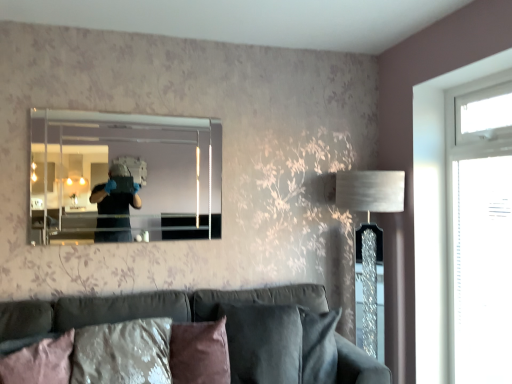
In order to face transparent glass window at right, should I rotate leftwards or rightwards?

To face it directly, rotate right by 28.331 degrees.

Locate an element on the screen. velvet dark gray couch at lower center is located at coordinates (141, 308).

Where is `transparent glass door at right`? transparent glass door at right is located at coordinates (482, 269).

Measure the distance between point (494, 338) and camera.

Point (494, 338) is 2.25 meters away from camera.

Locate an element on the screen. The height and width of the screenshot is (384, 512). clear glass mirror at upper center is located at coordinates (124, 176).

What do you see at coordinates (370, 230) in the screenshot? The image size is (512, 384). I see `silver textured lampshade at right` at bounding box center [370, 230].

Describe the element at coordinates (199, 353) in the screenshot. Image resolution: width=512 pixels, height=384 pixels. I see `brown suede pillow at lower center, the first pillow viewed from the right` at that location.

Find the location of a particular element. transparent glass window at right is located at coordinates (436, 207).

Considering the positions of objects transparent glass door at right and clear glass mirror at upper center in the image provided, who is more to the right, transparent glass door at right or clear glass mirror at upper center?

Positioned to the right is transparent glass door at right.

You are a GUI agent. You are given a task and a screenshot of the screen. Output one action in this format:
    pyautogui.click(x=<x>, y=<y>)
    Task: Click on the mirror above the transparent glass door at right (from the image's perspective)
    The height and width of the screenshot is (384, 512).
    Given the screenshot: What is the action you would take?
    pyautogui.click(x=124, y=176)

Who is shorter, transparent glass door at right or clear glass mirror at upper center?

clear glass mirror at upper center.

Considering the sizes of objects transparent glass door at right and clear glass mirror at upper center in the image provided, who is smaller, transparent glass door at right or clear glass mirror at upper center?

transparent glass door at right.

Are clear glass mirror at upper center and silver textured lampshade at right making contact?

clear glass mirror at upper center is not next to silver textured lampshade at right, and they're not touching.

Is clear glass mirror at upper center closer to camera compared to silver textured lampshade at right?

Yes, it is in front of silver textured lampshade at right.

Based on the photo, from a real-world perspective, is clear glass mirror at upper center positioned above or below silver textured lampshade at right?

clear glass mirror at upper center is situated higher than silver textured lampshade at right in the real world.

Find the location of a particular element. table lamp behind the clear glass mirror at upper center is located at coordinates (370, 230).

Consider the image. From their relative heights in the image, would you say transparent glass door at right is taller or shorter than transparent glass window at right?

In the image, transparent glass door at right appears to be shorter than transparent glass window at right.

Which point is more distant from viewer, (472, 192) or (426, 191)?

The point (426, 191) is farther from the camera.

You are a GUI agent. You are given a task and a screenshot of the screen. Output one action in this format:
    pyautogui.click(x=<x>, y=<y>)
    Task: Click on the glass door on the left side of transparent glass window at right
    This screenshot has width=512, height=384.
    Given the screenshot: What is the action you would take?
    pyautogui.click(x=482, y=269)

From a real-world perspective, is transparent glass door at right positioned above or below transparent glass window at right?

transparent glass door at right is below transparent glass window at right.

Based on the photo, would you say velvet dark gray couch at lower center is a long distance from brown suede pillow at lower center, the 2th pillow when ordered from left to right?

No, there isn't a large distance between velvet dark gray couch at lower center and brown suede pillow at lower center, the 2th pillow when ordered from left to right.

Is velvet dark gray couch at lower center taller than brown suede pillow at lower center, the first pillow viewed from the right?

Yes, velvet dark gray couch at lower center is taller than brown suede pillow at lower center, the first pillow viewed from the right.

Looking at this image, how different are the orientations of velvet dark gray couch at lower center and brown suede pillow at lower center, the 2th pillow when ordered from left to right, in degrees?

26.8 degrees.

Is velvet dark gray couch at lower center outside of brown suede pillow at lower center, the first pillow viewed from the right?

Yes, velvet dark gray couch at lower center is outside of brown suede pillow at lower center, the first pillow viewed from the right.

Does brown suede pillow at lower center, the first pillow viewed from the right, have a lesser height compared to transparent glass window at right?

Yes, brown suede pillow at lower center, the first pillow viewed from the right, is shorter than transparent glass window at right.

Which of these two, brown suede pillow at lower center, the 2th pillow when ordered from left to right, or transparent glass window at right, is thinner?

Thinner between the two is transparent glass window at right.

Visually, is brown suede pillow at lower center, the first pillow viewed from the right, positioned to the left or to the right of transparent glass window at right?

brown suede pillow at lower center, the first pillow viewed from the right, is positioned on transparent glass window at right's left side.

Measure the distance from brown suede pillow at lower center, the 2th pillow when ordered from left to right, to transparent glass window at right.

A distance of 4.61 feet exists between brown suede pillow at lower center, the 2th pillow when ordered from left to right, and transparent glass window at right.

Is pink fabric pillow at lower left, acting as the 1th pillow starting from the left, oriented towards silver textured lampshade at right?

No, pink fabric pillow at lower left, acting as the 1th pillow starting from the left, is not oriented towards silver textured lampshade at right.

From the image's perspective, which one is positioned lower, pink fabric pillow at lower left, acting as the second pillow starting from the right, or silver textured lampshade at right?

From the image's view, pink fabric pillow at lower left, acting as the second pillow starting from the right, is below.

Could you measure the distance between pink fabric pillow at lower left, acting as the 1th pillow starting from the left, and silver textured lampshade at right?

pink fabric pillow at lower left, acting as the 1th pillow starting from the left, and silver textured lampshade at right are 5.67 feet apart.

Who is smaller, silver textured lampshade at right or pink fabric pillow at lower left, acting as the 1th pillow starting from the left?

pink fabric pillow at lower left, acting as the 1th pillow starting from the left.

Considering the relative sizes of silver textured lampshade at right and pink fabric pillow at lower left, acting as the second pillow starting from the right, in the image provided, is silver textured lampshade at right taller than pink fabric pillow at lower left, acting as the second pillow starting from the right,?

Yes.

Would you say silver textured lampshade at right is outside pink fabric pillow at lower left, acting as the 1th pillow starting from the left?

Absolutely, silver textured lampshade at right is external to pink fabric pillow at lower left, acting as the 1th pillow starting from the left.

Measure the distance from silver textured lampshade at right to pink fabric pillow at lower left, acting as the second pillow starting from the right.

silver textured lampshade at right and pink fabric pillow at lower left, acting as the second pillow starting from the right, are 1.73 meters apart.

The width and height of the screenshot is (512, 384). I want to click on mirror that appears above the transparent glass door at right (from the image's perspective), so click(124, 176).

The height and width of the screenshot is (384, 512). I want to click on mirror on the left of silver textured lampshade at right, so click(124, 176).

Considering their positions, is velvet dark gray couch at lower center positioned further to clear glass mirror at upper center than transparent glass door at right?

transparent glass door at right.

Looking at this image, based on their spatial positions, is brown suede pillow at lower center, the first pillow viewed from the right, or transparent glass door at right closer to transparent glass window at right?

transparent glass door at right is positioned closer to the anchor transparent glass window at right.

Based on their spatial positions, is pink fabric pillow at lower left, acting as the 1th pillow starting from the left, or clear glass mirror at upper center closer to silver textured lampshade at right?

clear glass mirror at upper center is positioned closer to the anchor silver textured lampshade at right.

When comparing their distances from transparent glass window at right, does velvet dark gray couch at lower center or silver textured lampshade at right seem further?

Among the two, velvet dark gray couch at lower center is located further to transparent glass window at right.

From the image, which object appears to be nearer to pink fabric pillow at lower left, acting as the second pillow starting from the right, transparent glass door at right or brown suede pillow at lower center, the first pillow viewed from the right?

brown suede pillow at lower center, the first pillow viewed from the right, is closer to pink fabric pillow at lower left, acting as the second pillow starting from the right.

Considering their positions, is clear glass mirror at upper center positioned further to silver textured lampshade at right than pink fabric pillow at lower left, acting as the 1th pillow starting from the left?

pink fabric pillow at lower left, acting as the 1th pillow starting from the left.

Which object lies further to the anchor point silver textured lampshade at right, transparent glass door at right or transparent glass window at right?

Based on the image, transparent glass door at right appears to be further to silver textured lampshade at right.

Considering their positions, is velvet dark gray couch at lower center positioned closer to silver textured lampshade at right than transparent glass window at right?

Among the two, transparent glass window at right is located nearer to silver textured lampshade at right.

The height and width of the screenshot is (384, 512). I want to click on glass door situated between brown suede pillow at lower center, the first pillow viewed from the right, and transparent glass window at right from left to right, so click(482, 269).

Locate an element on the screen. The height and width of the screenshot is (384, 512). table lamp between pink fabric pillow at lower left, acting as the 1th pillow starting from the left, and transparent glass door at right is located at coordinates (370, 230).

Locate an element on the screen. mirror between pink fabric pillow at lower left, acting as the second pillow starting from the right, and silver textured lampshade at right is located at coordinates (124, 176).

Identify the location of studio couch situated between clear glass mirror at upper center and transparent glass window at right from left to right. (141, 308).